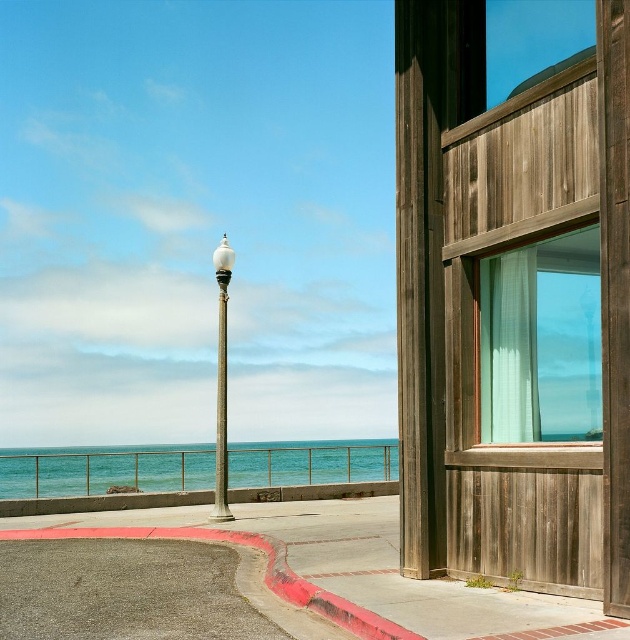
In the scene shown: You are a photographer trying to capture the blue water at lower left and the white glossy lamp post at center in a single frame. Which object appears larger in the image?

The blue water at lower left appears larger than the white glossy lamp post at center in the image.